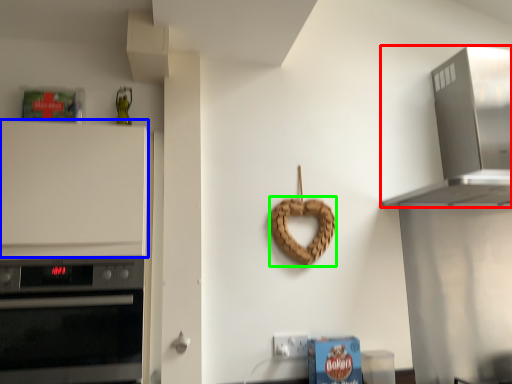
Question: Estimate the real-world distances between objects in this image. Which object is closer to home appliance (highlighted by a red box), cabinetry (highlighted by a blue box) or pretzel (highlighted by a green box)?

Choices:
 (A) cabinetry
 (B) pretzel

Answer: (B)